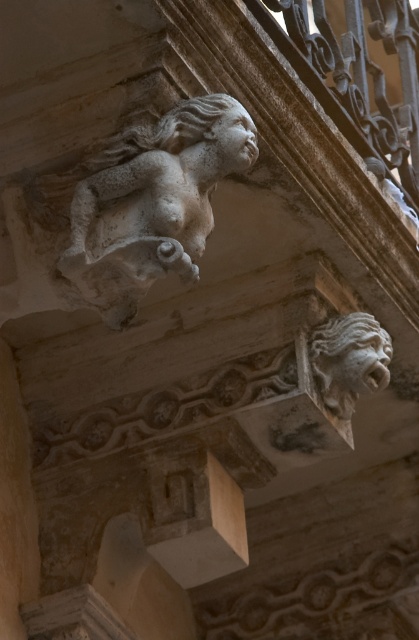
You are an architect examining the ornate architectural detail. You notice the white stone cherub at upper left and the smooth stone face at upper center. Which object occupies a larger vertical space in the image?

The white stone cherub at upper left is much taller than the smooth stone face at upper center, so it occupies a larger vertical space in the image.